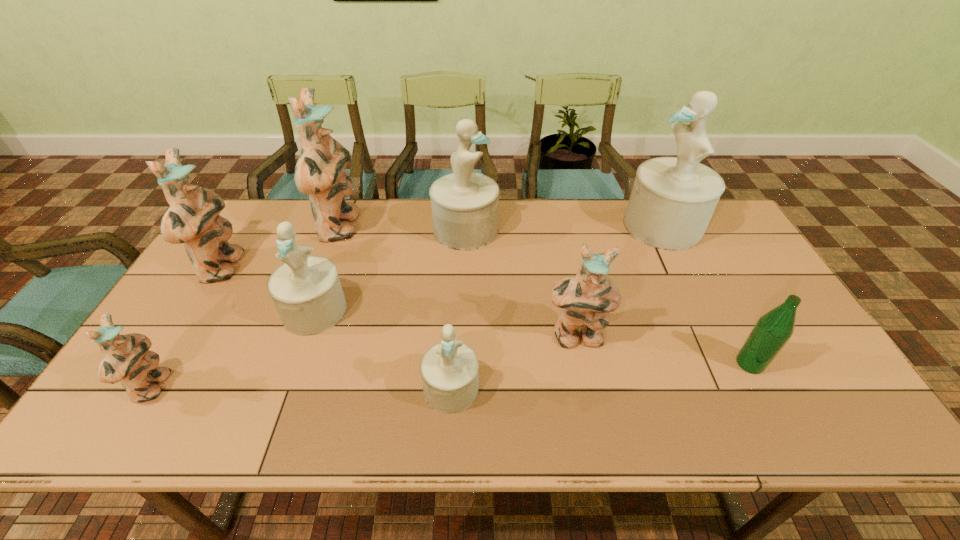
Locate an element on the screen. blank area in the image that satisfies the following two spatial constraints: 1. at the beak of the third farthest white figurine; 2. on the front-facing side of the smallest pink figurine is located at coordinates (287, 388).

This screenshot has height=540, width=960. I want to click on free space that satisfies the following two spatial constraints: 1. at the beak of the rightmost white figurine; 2. on the left side of the green bottle, so click(x=731, y=363).